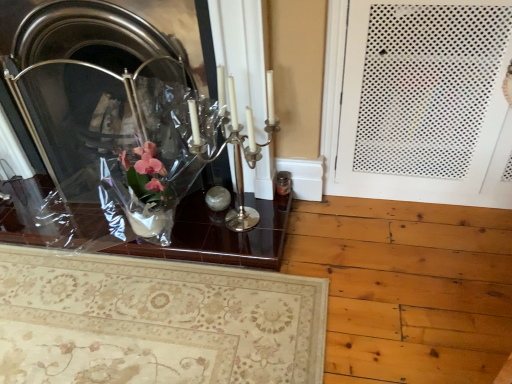
Question: From the image's perspective, is clear glass fireplace at upper left on shiny glass table at center?

Choices:
 (A) yes
 (B) no

Answer: (A)

Question: Can you confirm if clear glass fireplace at upper left is positioned to the left of shiny glass table at center?

Choices:
 (A) yes
 (B) no

Answer: (B)

Question: Is clear glass fireplace at upper left aimed at shiny glass table at center?

Choices:
 (A) yes
 (B) no

Answer: (B)

Question: Is clear glass fireplace at upper left closer to camera compared to shiny glass table at center?

Choices:
 (A) yes
 (B) no

Answer: (A)

Question: From a real-world perspective, is clear glass fireplace at upper left physically above shiny glass table at center?

Choices:
 (A) no
 (B) yes

Answer: (B)

Question: Does clear glass fireplace at upper left have a greater height compared to shiny glass table at center?

Choices:
 (A) no
 (B) yes

Answer: (B)

Question: From a real-world perspective, is shiny glass table at center over clear glass fireplace at upper left?

Choices:
 (A) no
 (B) yes

Answer: (A)

Question: From the image's perspective, is shiny glass table at center beneath clear glass fireplace at upper left?

Choices:
 (A) yes
 (B) no

Answer: (A)

Question: Are shiny glass table at center and clear glass fireplace at upper left located far from each other?

Choices:
 (A) yes
 (B) no

Answer: (B)

Question: Is shiny glass table at center positioned beyond the bounds of clear glass fireplace at upper left?

Choices:
 (A) no
 (B) yes

Answer: (B)

Question: Can clear glass fireplace at upper left be found inside shiny glass table at center?

Choices:
 (A) yes
 (B) no

Answer: (B)

Question: From the image's perspective, is shiny glass table at center above clear glass fireplace at upper left?

Choices:
 (A) yes
 (B) no

Answer: (B)

Question: Does shiny glass table at center have a greater width compared to white perforated door at right?

Choices:
 (A) no
 (B) yes

Answer: (B)